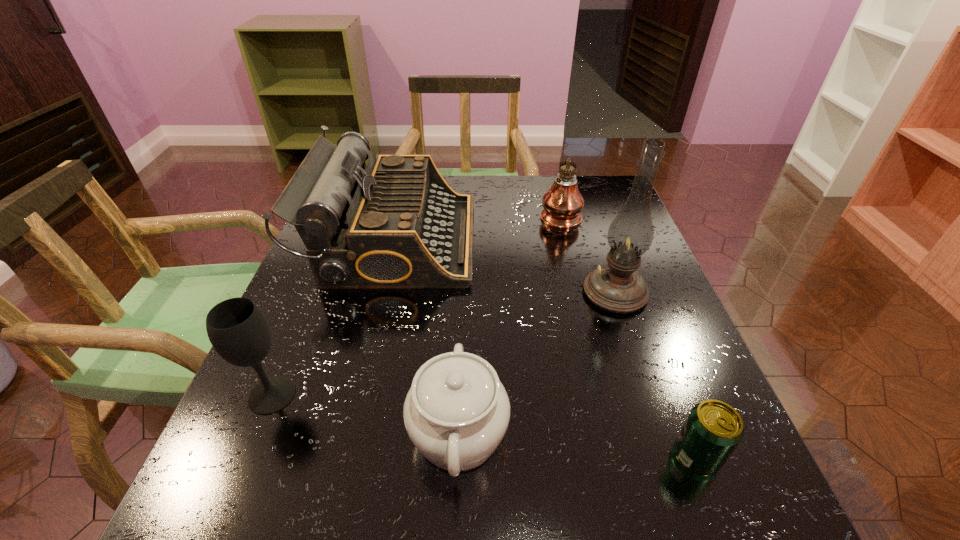
At what (x,y) coordinates should I click in order to perform the action: click on free location located 0.340m on the keyboard of the typewriter. Please return your answer as a coordinate pair (x, y). The width and height of the screenshot is (960, 540). Looking at the image, I should click on (612, 240).

The height and width of the screenshot is (540, 960). I want to click on vacant space situated on the right of the wineglass, so click(x=454, y=395).

Locate an element on the screen. The height and width of the screenshot is (540, 960). free region located 0.160m on the left of the chinaware is located at coordinates (307, 434).

Locate an element on the screen. The image size is (960, 540). free space located on the left of the shortest object is located at coordinates [x=418, y=456].

Find the location of a particular element. This screenshot has width=960, height=540. oil lamp that is at the far edge is located at coordinates (563, 202).

Locate an element on the screen. The image size is (960, 540). typewriter that is positioned at the far edge is located at coordinates (396, 224).

Locate an element on the screen. This screenshot has width=960, height=540. chinaware at the near edge is located at coordinates (456, 413).

Find the location of a particular element. beer can that is at the near edge is located at coordinates (712, 431).

What are the coordinates of `typewriter situated at the left edge` in the screenshot? It's located at (396, 224).

The width and height of the screenshot is (960, 540). In order to click on wineglass that is at the left edge in this screenshot , I will do `click(238, 330)`.